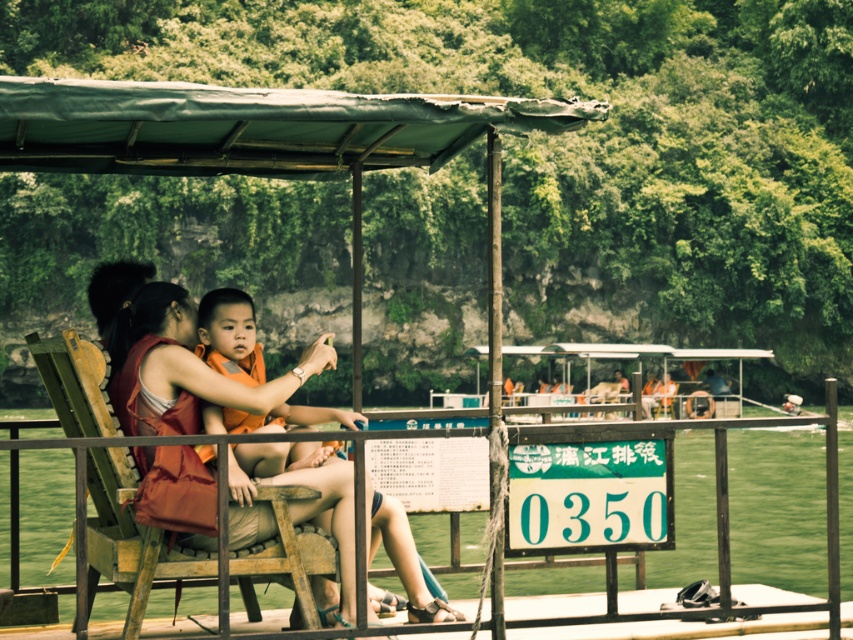
You are a passenger sitting on the wooden chair at center of the boat. You want to reach the green fabric canopy at upper center to adjust its position. Can you easily reach it from your current position?

The green fabric canopy at upper center is closer to the viewer than the wooden chair at center, so you can easily reach it from your current position.

You are a passenger on the boat and want to sit down. There is a wooden chair at center and an orange fabric life jacket at center. Which one is closer to you if you are standing at the front of the boat?

The wooden chair at center is in front of the orange fabric life jacket at center, so if you are standing at the front of the boat, the wooden chair at center is closer to you.

You are on a boat and need to sit down. There is a wooden chair at center and an orange fabric life jacket at center. Which one is lower and can you sit on?

The wooden chair at center is located below the orange fabric life jacket at center, so you can sit on the wooden chair at center.